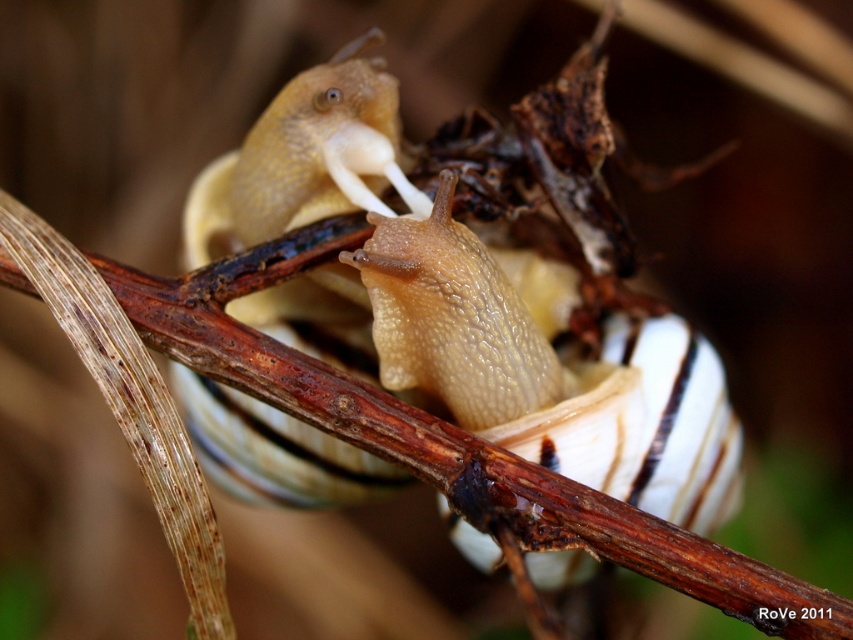
Question: Which object is the farthest from the translucent beige snail at center?

Choices:
 (A) glossy beige snail at center
 (B) brown rough tree branch at center

Answer: (B)

Question: Which point is farther from the camera taking this photo?

Choices:
 (A) (294, 449)
 (B) (726, 589)
 (C) (553, 440)

Answer: (A)

Question: Which object is the closest to the brown rough tree branch at center?

Choices:
 (A) translucent beige snail at center
 (B) glossy beige snail at center

Answer: (B)

Question: Can you confirm if brown rough tree branch at center is bigger than translucent beige snail at center?

Choices:
 (A) no
 (B) yes

Answer: (A)

Question: Is glossy beige snail at center bigger than translucent beige snail at center?

Choices:
 (A) no
 (B) yes

Answer: (B)

Question: Does brown rough tree branch at center appear on the left side of translucent beige snail at center?

Choices:
 (A) yes
 (B) no

Answer: (B)